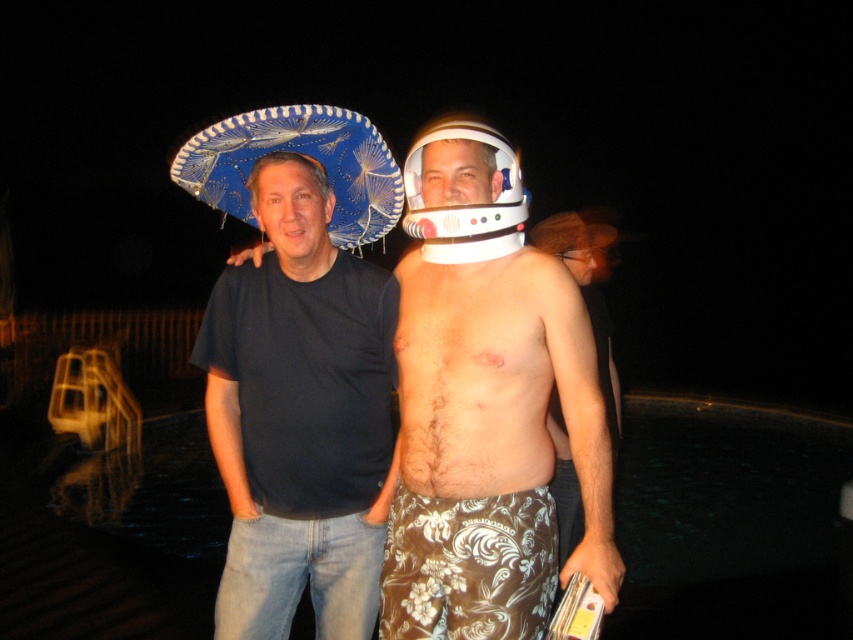
Describe the element at coordinates (300, 413) in the screenshot. This screenshot has width=853, height=640. I see `black cotton t-shirt at center` at that location.

Who is shorter, black cotton t-shirt at center or hairless skin at center?

With less height is hairless skin at center.

Does point (204, 324) lie in front of point (468, 394)?

No, (204, 324) is further to viewer.

At what (x,y) coordinates should I click in order to perform the action: click on black cotton t-shirt at center. Please return your answer as a coordinate pair (x, y). Looking at the image, I should click on (300, 413).

Which is above, smooth white helmet at center or black cotton t-shirt at center?

Positioned higher is smooth white helmet at center.

Can you confirm if smooth white helmet at center is positioned below black cotton t-shirt at center?

No.

Who is more forward, (440, 397) or (201, 362)?

Point (440, 397) is more forward.

Where is `smooth white helmet at center`? smooth white helmet at center is located at coordinates (486, 376).

Between point (471, 360) and point (218, 163), which one is positioned in front?

Point (471, 360) is in front.

How distant is smooth white helmet at center from blue woven sombrero at upper left?

smooth white helmet at center is 58.22 centimeters from blue woven sombrero at upper left.

Between point (550, 525) and point (351, 218), which one is positioned behind?

Point (351, 218)

At what (x,y) coordinates should I click in order to perform the action: click on smooth white helmet at center. Please return your answer as a coordinate pair (x, y). Looking at the image, I should click on (486, 376).